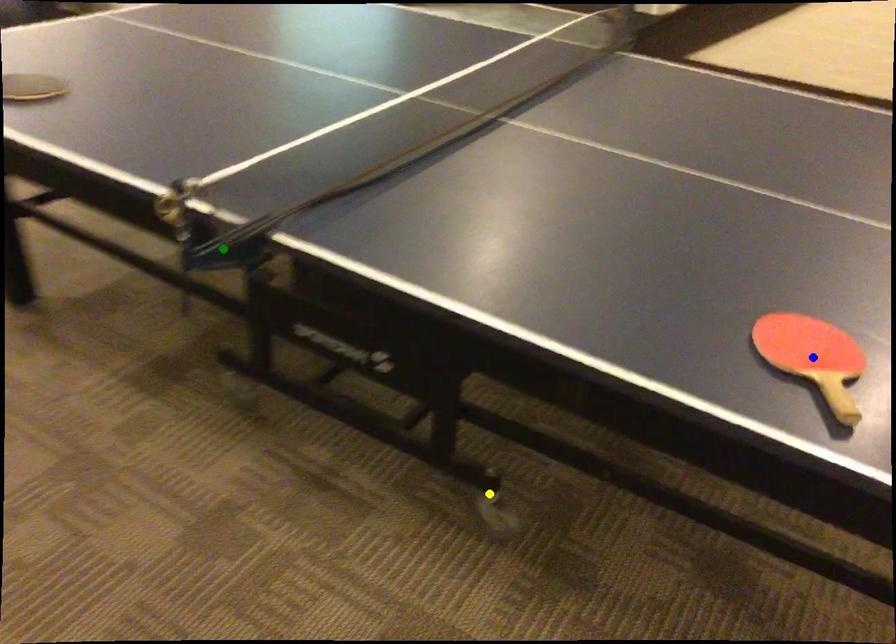
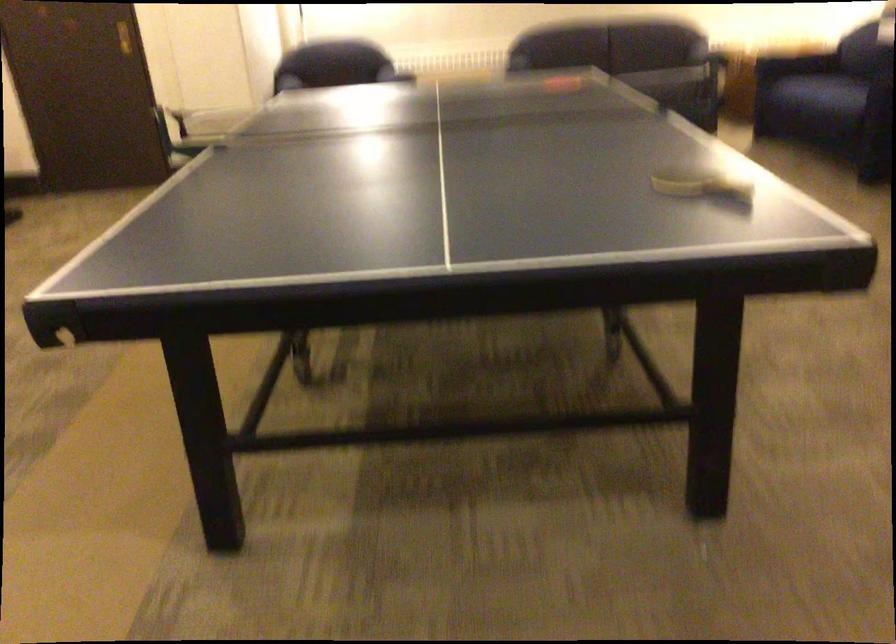
I am providing you with two images of the same scene from different viewpoints. Three points are marked in image1. Which point corresponds to a part or object that is occluded in image2?In image1, three points are marked. Which of them correspond to a part or object that is occluded in image2?Among the three points shown in image1, which one corresponds to a part or object that is no longer visible due to occlusion in image2?

blue point, yellow point